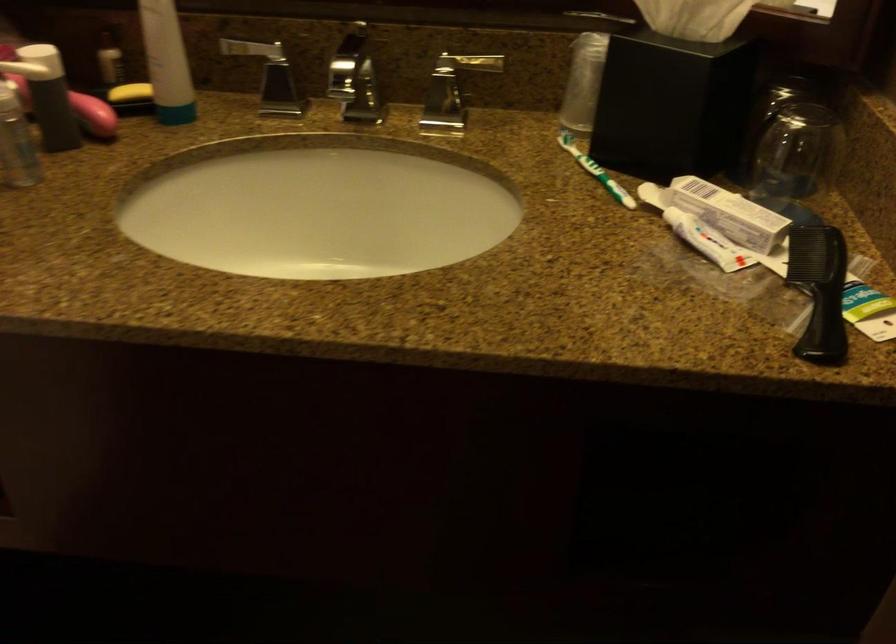
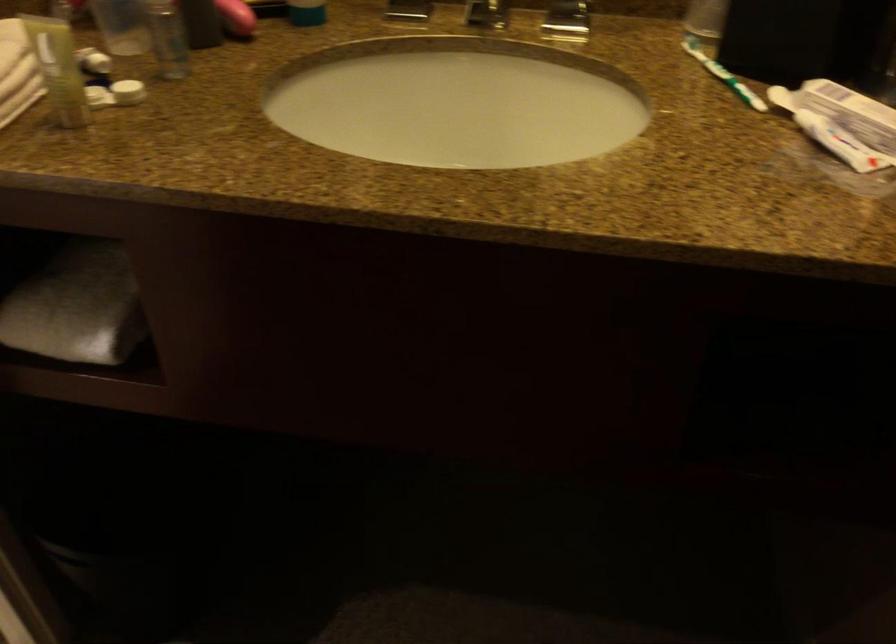
In the second image, find the point that corresponds to the point at 360,109 in the first image.

(486, 15)